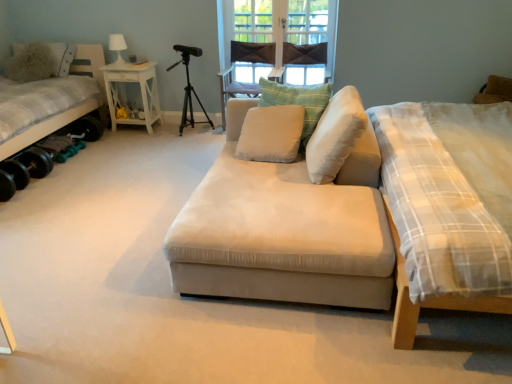
At what (x,y) coordinates should I click in order to perform the action: click on free spot above dark fabric window screen at center (from a real-world perspective). Please return your answer as a coordinate pair (x, y). This screenshot has height=384, width=512. Looking at the image, I should click on (275, 1).